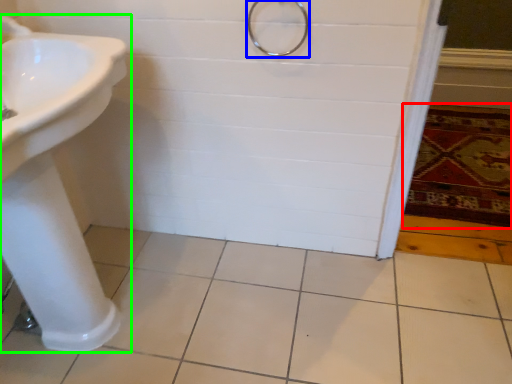
Question: Considering the real-world distances, which object is farthest from bath mat (highlighted by a red box)? shower (highlighted by a blue box) or sink (highlighted by a green box)?

Choices:
 (A) shower
 (B) sink

Answer: (B)